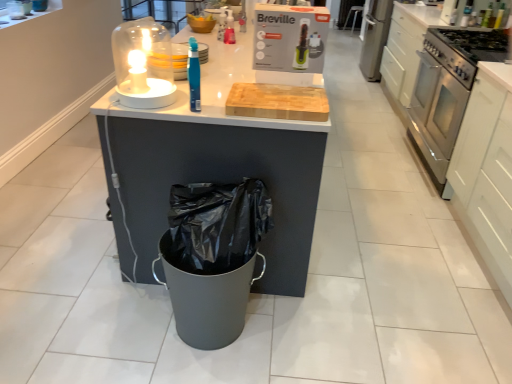
Question: From a real-world perspective, is stainless steel oven at right physically located above or below translucent blue toothbrush at center?

Choices:
 (A) below
 (B) above

Answer: (A)

Question: Considering the positions of stainless steel oven at right and translucent blue toothbrush at center in the image, is stainless steel oven at right wider or thinner than translucent blue toothbrush at center?

Choices:
 (A) wide
 (B) thin

Answer: (A)

Question: Considering the real-world distances, which object is farthest from the green plastic hairdryer at upper center?

Choices:
 (A) white matte cabinet at right
 (B) metallic silver bar stool at center
 (C) stainless steel oven at right
 (D) stainless steel gas stove at right
 (E) translucent glass candle at upper left

Answer: (B)

Question: Which object is the closest to the stainless steel oven at right?

Choices:
 (A) translucent blue toothbrush at center
 (B) white matte cabinet at right
 (C) green plastic hairdryer at upper center
 (D) metallic silver bar stool at center
 (E) stainless steel gas stove at right

Answer: (E)